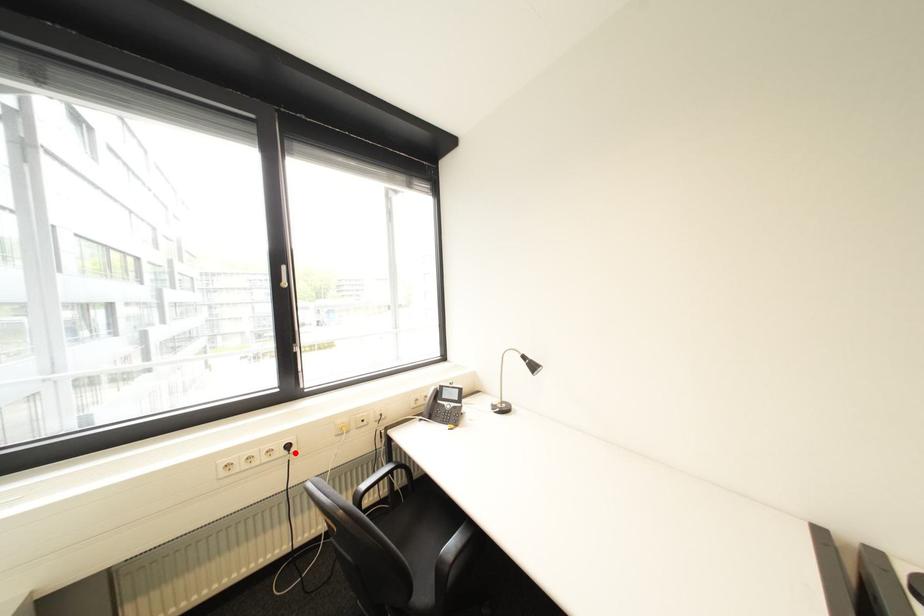
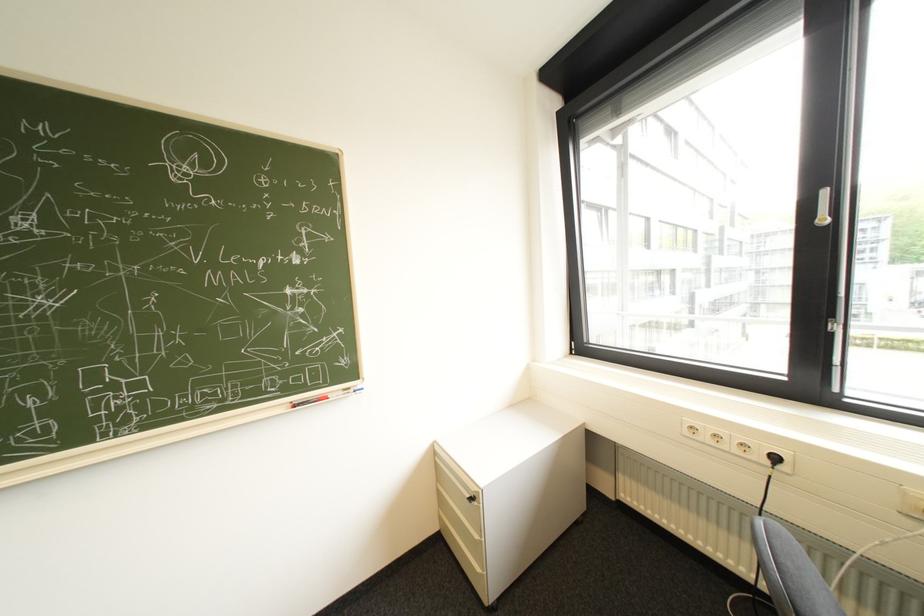
In the second image, find the point that corresponds to the highlighted location in the first image.

(779, 463)